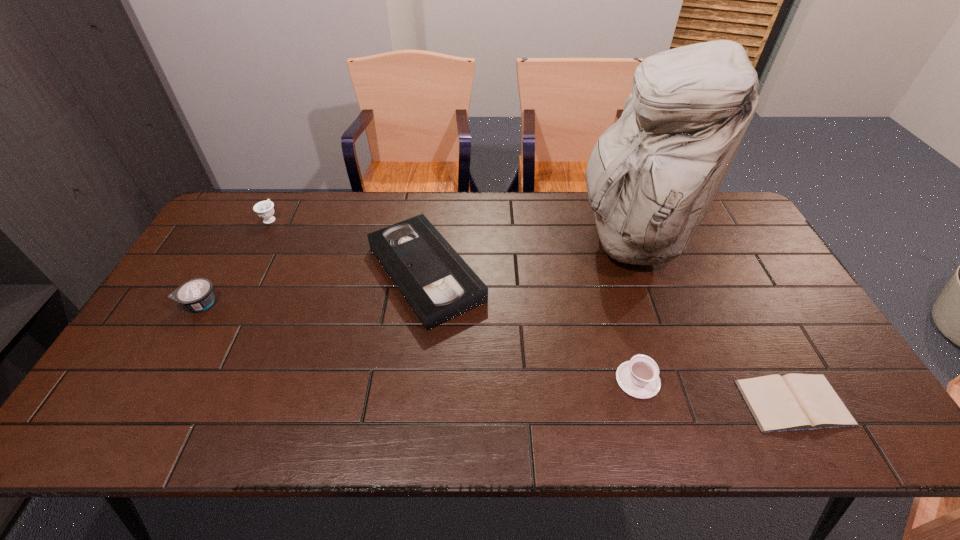
You are a GUI agent. You are given a task and a screenshot of the screen. Output one action in this format:
    pyautogui.click(x=<x>, y=<y>)
    Task: Click on the free space located 0.400m on the handle side of the nearer teacup
    The image size is (960, 540).
    Given the screenshot: What is the action you would take?
    pyautogui.click(x=602, y=253)

At what (x,y) coordinates should I click in order to perform the action: click on vacant region located on the handle side of the nearer teacup. Please return your answer as a coordinate pair (x, y). Looking at the image, I should click on (605, 264).

Locate an element on the screen. vacant space located 0.190m on the handle side of the nearer teacup is located at coordinates (616, 303).

You are a GUI agent. You are given a task and a screenshot of the screen. Output one action in this format:
    pyautogui.click(x=<x>, y=<y>)
    Task: Click on the vacant space positioned on the front of the yogurt
    This screenshot has height=540, width=960.
    Given the screenshot: What is the action you would take?
    pyautogui.click(x=173, y=350)

What are the coordinates of `free region located 0.060m on the back of the shortest object` in the screenshot? It's located at (768, 354).

This screenshot has height=540, width=960. In order to click on backpack that is positioned at the far edge in this screenshot , I will do `click(652, 176)`.

Identify the location of teacup located in the far edge section of the desktop. (264, 209).

This screenshot has height=540, width=960. I want to click on videotape positioned at the far edge, so click(437, 283).

Identify the location of object that is at the near edge. The height and width of the screenshot is (540, 960). (791, 402).

Locate an element on the screen. teacup positioned at the left edge is located at coordinates (264, 209).